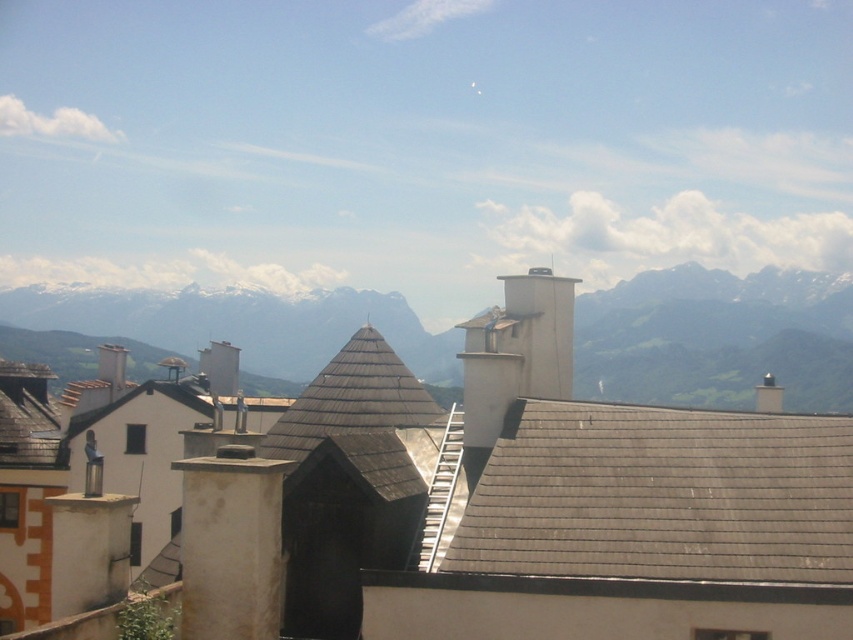
You are standing at the base of the mountain range in the town shown. You see a point marked at coordinates [717,337]. Where is this point located in relation to the town and the mountain range?

The point at [717,337] is located on the green grassy mountain range at upper center, which is above the town nestled at the foot of the mountain range.

You are standing in the town square and want to locate the gray shingles at upper right. According to the image, where exactly is the point (x=660, y=496) located?

The point (x=660, y=496) is on the gray shingles at upper right.